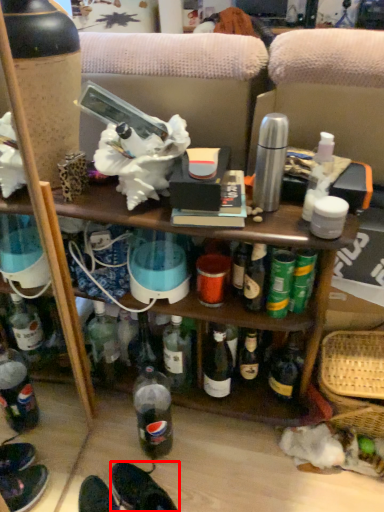
Question: From the image's perspective, what is the correct spatial positioning of footwear (annotated by the red box) in reference to basket?

Choices:
 (A) above
 (B) below

Answer: (B)